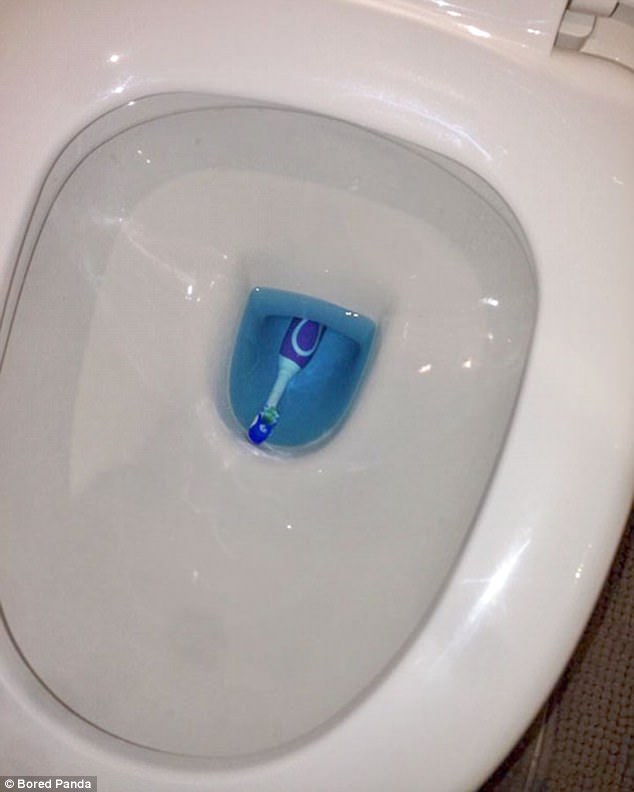
Find the location of a particular element. porcelain is located at coordinates (278, 642).